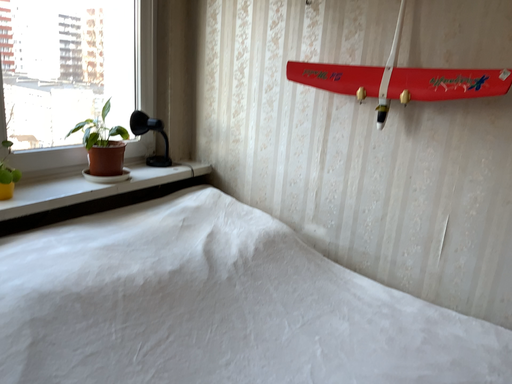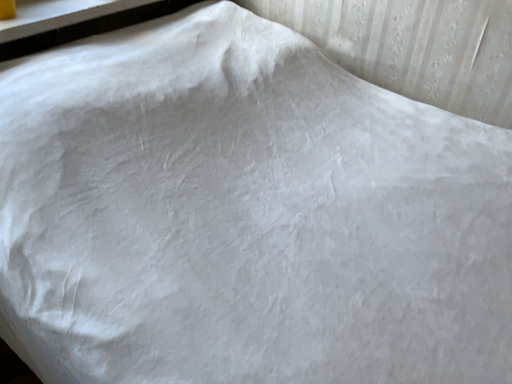
Question: Which way did the camera rotate in the video?

Choices:
 (A) rotated downward
 (B) rotated upward

Answer: (A)